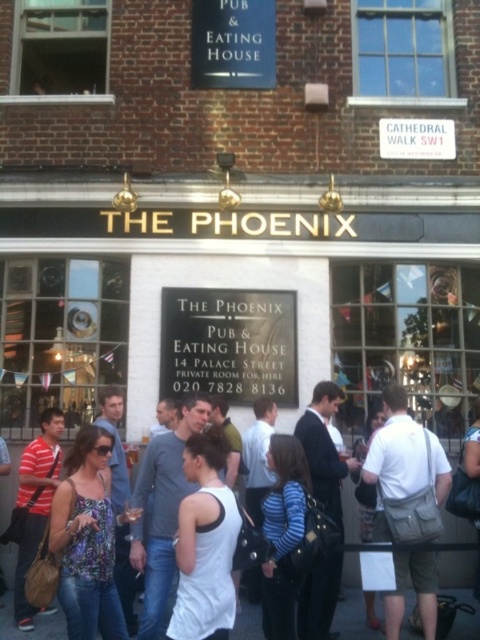
Question: Can you confirm if metallic signboard at center is smaller than white cotton tank top at center?

Choices:
 (A) yes
 (B) no

Answer: (A)

Question: Is metallic signboard at center thinner than white cotton tank top at center?

Choices:
 (A) no
 (B) yes

Answer: (B)

Question: Which point is closer to the camera taking this photo?

Choices:
 (A) (286, 342)
 (B) (0, 625)

Answer: (B)

Question: Does metallic signboard at center have a lesser width compared to white cotton tank top at center?

Choices:
 (A) no
 (B) yes

Answer: (B)

Question: Which of the following is the closest to the observer?

Choices:
 (A) metallic signboard at center
 (B) white cotton tank top at center

Answer: (B)